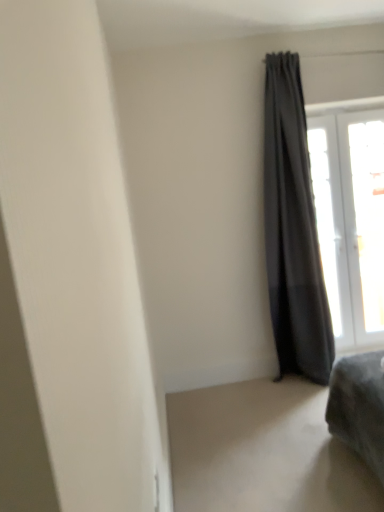
Question: Is transparent glass window at upper right, which ranks as the 2th window in left-to-right order, touching transparent glass window at upper right, the first window when ordered from left to right?

Choices:
 (A) no
 (B) yes

Answer: (B)

Question: Is transparent glass window at upper right, the first window when ordered from right to left, positioned in front of transparent glass window at upper right, the first window when ordered from left to right?

Choices:
 (A) no
 (B) yes

Answer: (A)

Question: Considering the relative sizes of transparent glass window at upper right, which ranks as the 2th window in left-to-right order, and transparent glass window at upper right, the first window when ordered from left to right, in the image provided, is transparent glass window at upper right, which ranks as the 2th window in left-to-right order, taller than transparent glass window at upper right, the first window when ordered from left to right,?

Choices:
 (A) no
 (B) yes

Answer: (A)

Question: Would you say transparent glass window at upper right, which ranks as the 2th window in left-to-right order, contains transparent glass window at upper right, which appears as the 2th window when viewed from the right?

Choices:
 (A) yes
 (B) no

Answer: (A)

Question: Is transparent glass window at upper right, which ranks as the 2th window in left-to-right order, bigger than transparent glass window at upper right, which appears as the 2th window when viewed from the right?

Choices:
 (A) no
 (B) yes

Answer: (A)

Question: Does transparent glass window at upper right, which ranks as the 2th window in left-to-right order, have a lesser width compared to transparent glass window at upper right, which appears as the 2th window when viewed from the right?

Choices:
 (A) no
 (B) yes

Answer: (B)

Question: Is transparent glass window at upper right, the first window when ordered from left to right, positioned beyond the bounds of dark gray fabric curtain at right?

Choices:
 (A) no
 (B) yes

Answer: (B)

Question: Does transparent glass window at upper right, which appears as the 2th window when viewed from the right, have a lesser height compared to dark gray fabric curtain at right?

Choices:
 (A) no
 (B) yes

Answer: (B)

Question: From a real-world perspective, does transparent glass window at upper right, which appears as the 2th window when viewed from the right, sit lower than dark gray fabric curtain at right?

Choices:
 (A) yes
 (B) no

Answer: (A)

Question: Is transparent glass window at upper right, the first window when ordered from left to right, directly adjacent to dark gray fabric curtain at right?

Choices:
 (A) yes
 (B) no

Answer: (B)

Question: Is transparent glass window at upper right, the first window when ordered from left to right, closer to camera compared to dark gray fabric curtain at right?

Choices:
 (A) no
 (B) yes

Answer: (A)

Question: Is transparent glass window at upper right, which appears as the 2th window when viewed from the right, turned away from dark gray fabric curtain at right?

Choices:
 (A) yes
 (B) no

Answer: (B)

Question: Is dark gray fabric curtain at right far away from transparent glass window at upper right, the first window when ordered from right to left?

Choices:
 (A) no
 (B) yes

Answer: (A)